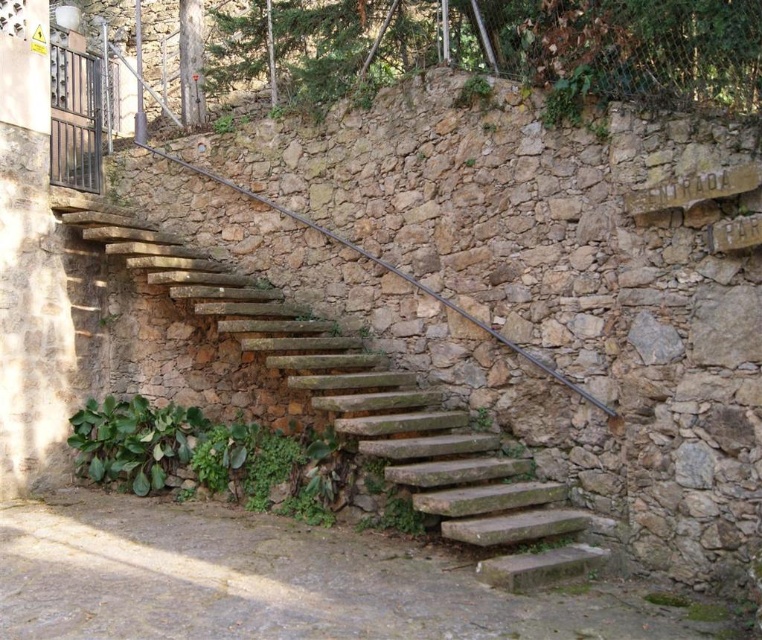
You are standing at the bottom of the rustic stone stairs at center and want to reach the green leafy ivy at upper center. Based on the scene, which direction should you move to get closer to the ivy?

You should move upward along the rustic stone stairs at center to get closer to the green leafy ivy at upper center, since the ivy is located at a higher position than the stairs.